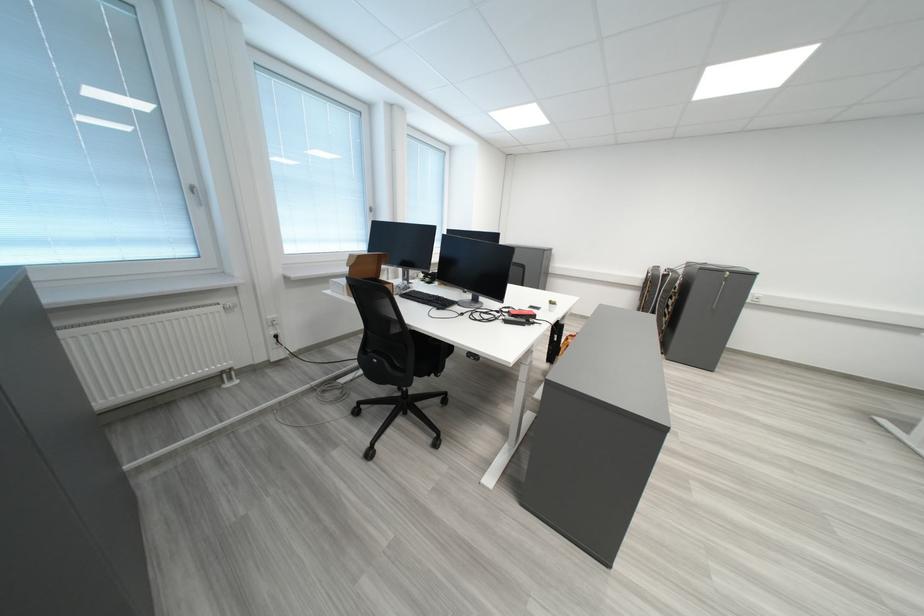
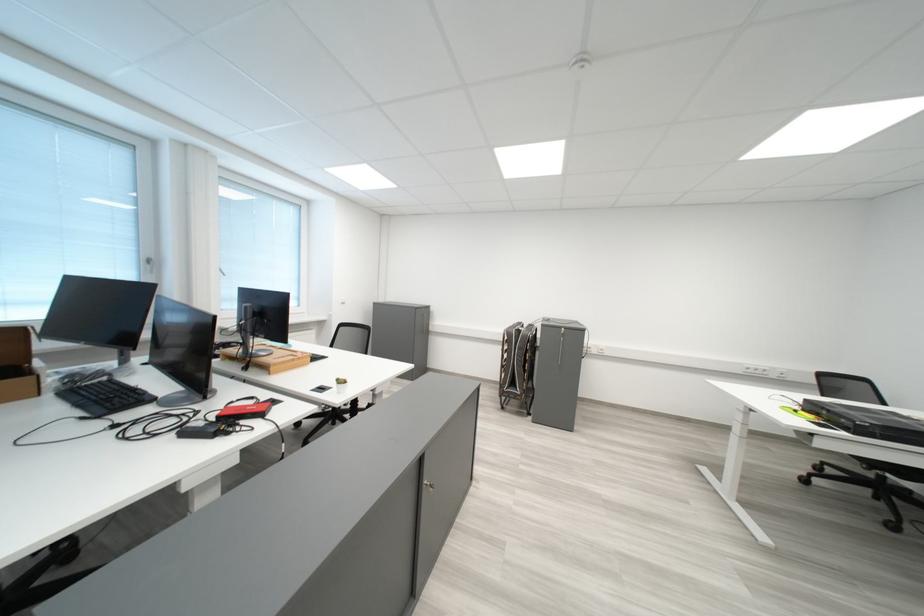
Find the pixel in the second image that matches (521,310) in the first image.

(264, 400)